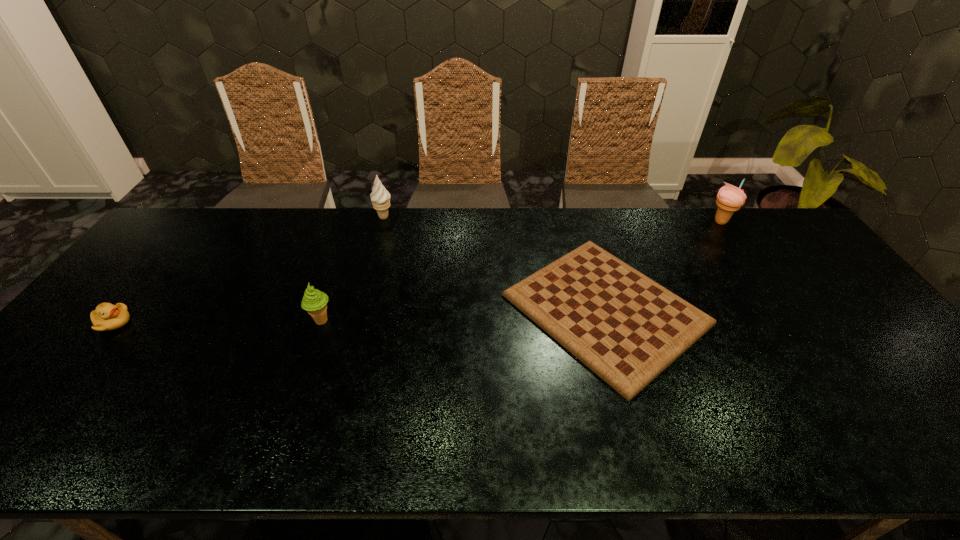
Find the location of `vacant space located on the left of the nearest icecream`. vacant space located on the left of the nearest icecream is located at coordinates (172, 321).

This screenshot has width=960, height=540. I want to click on vacant space located 0.230m on the front-facing side of the fourth tallest object, so click(215, 323).

In order to click on vacant space located 0.060m on the right of the shortest object in this screenshot , I will do `click(729, 309)`.

Find the location of a particular element. This screenshot has height=540, width=960. gameboard that is at the far edge is located at coordinates (625, 327).

Find the location of a particular element. The image size is (960, 540). object located at the left edge is located at coordinates (106, 317).

Where is `vacant region at the far edge of the desktop`? vacant region at the far edge of the desktop is located at coordinates (710, 218).

The height and width of the screenshot is (540, 960). In order to click on free region at the near edge of the desktop in this screenshot , I will do `click(163, 446)`.

At what (x,y) coordinates should I click in order to perform the action: click on vacant region at the left edge of the desktop. Please return your answer as a coordinate pair (x, y). The image size is (960, 540). Looking at the image, I should click on (140, 277).

In the image, there is a desktop. At what (x,y) coordinates should I click in order to perform the action: click on vacant space at the far right corner. Please return your answer as a coordinate pair (x, y). Image resolution: width=960 pixels, height=540 pixels. Looking at the image, I should click on click(x=773, y=218).

At what (x,y) coordinates should I click in order to perform the action: click on free area in between the leftmost icecream and the second icecream from left to right. Please return your answer as a coordinate pair (x, y). This screenshot has height=540, width=960. Looking at the image, I should click on (352, 269).